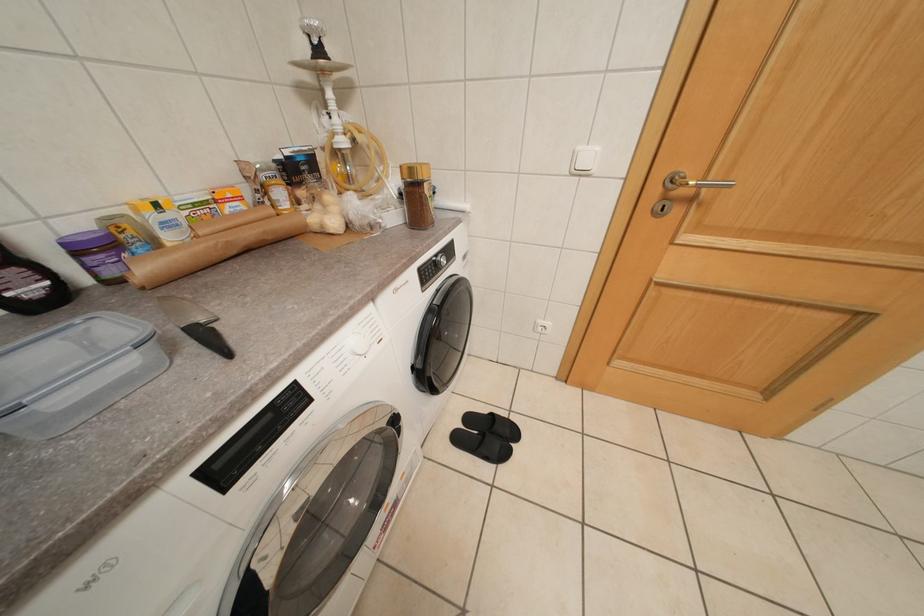
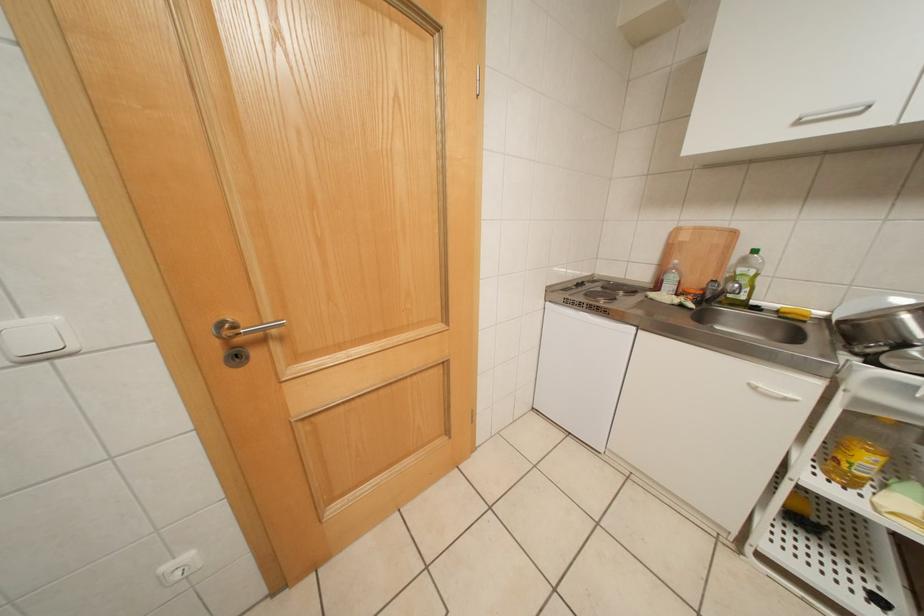
Question: The images are taken continuously from a first-person perspective. In which direction is your viewpoint rotating?

Choices:
 (A) Left
 (B) Right
 (C) Up
 (D) Down

Answer: (B)